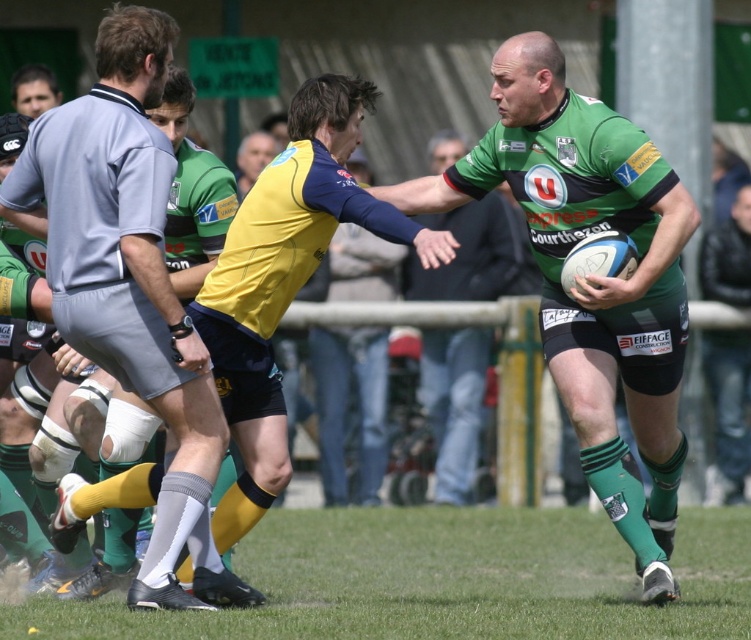
Question: Which object appears closest to the camera in this image?

Choices:
 (A) dark blue leather jacket at upper right
 (B) smooth gray shirt at upper left

Answer: (B)

Question: Which point appears farthest from the camera in this image?

Choices:
 (A) (719, 296)
 (B) (487, 225)
 (C) (41, 77)

Answer: (B)

Question: Is the position of green jersey at center more distant than that of smooth gray shirt at upper left?

Choices:
 (A) yes
 (B) no

Answer: (A)

Question: Which point is farther from the camera taking this photo?

Choices:
 (A) (56, 168)
 (B) (550, 339)

Answer: (B)

Question: Is yellow jersey at center to the left of smooth gray shirt at upper left from the viewer's perspective?

Choices:
 (A) yes
 (B) no

Answer: (B)

Question: Observing the image, what is the correct spatial positioning of yellow jersey at center in reference to smooth gray shirt at upper left?

Choices:
 (A) below
 (B) above

Answer: (A)